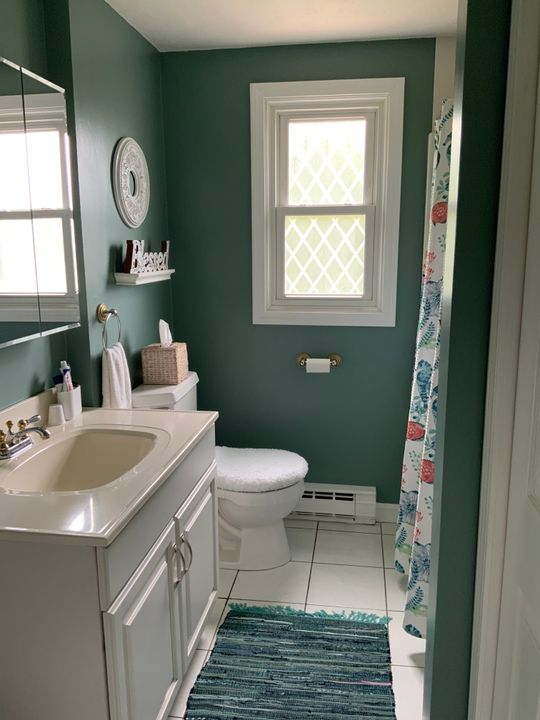
Where is `2 cabinets`? 2 cabinets is located at coordinates (151, 665), (210, 577).